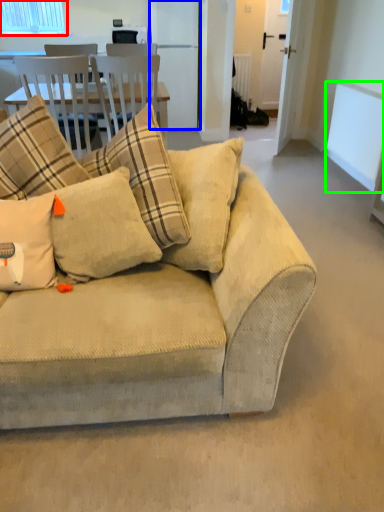
Question: Which is nearer to the window (highlighted by a red box)? appliance (highlighted by a blue box) or window screen (highlighted by a green box).

Choices:
 (A) appliance
 (B) window screen

Answer: (A)